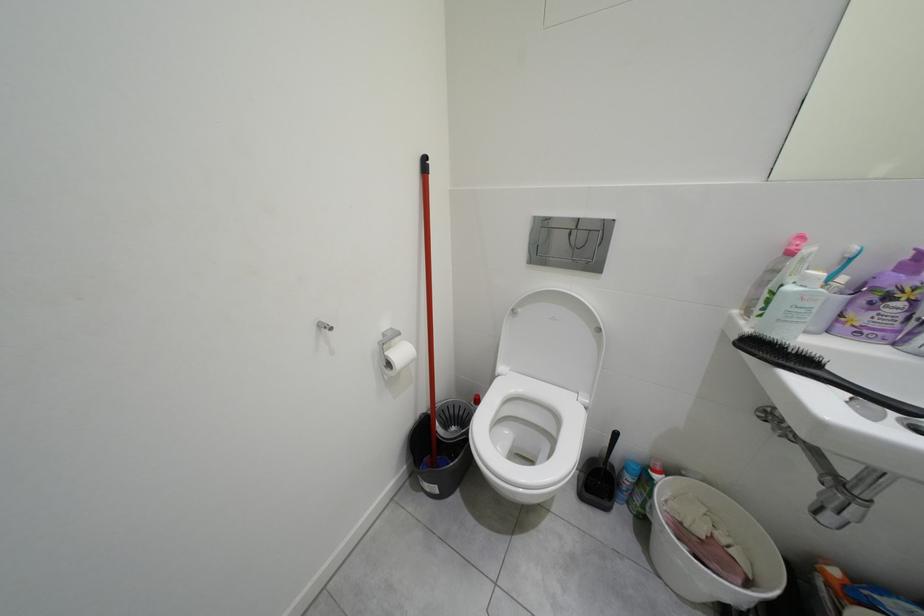
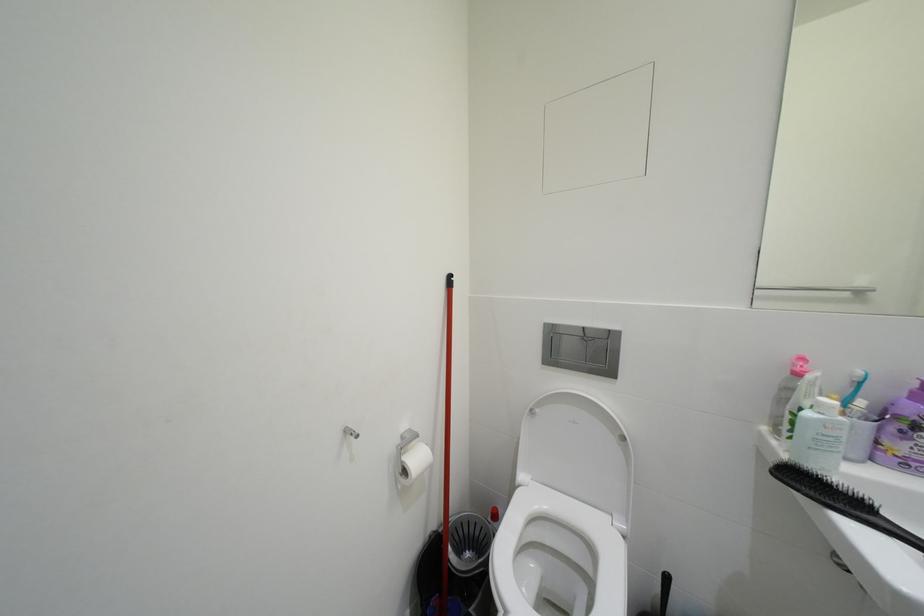
What movement of the cameraman would produce the second image?

The cameraman walked toward left, backward.